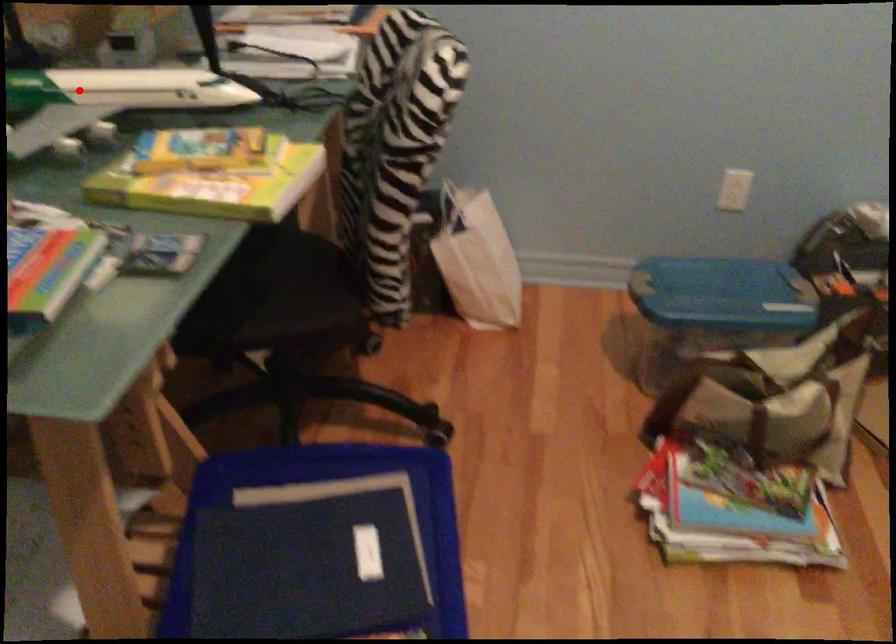
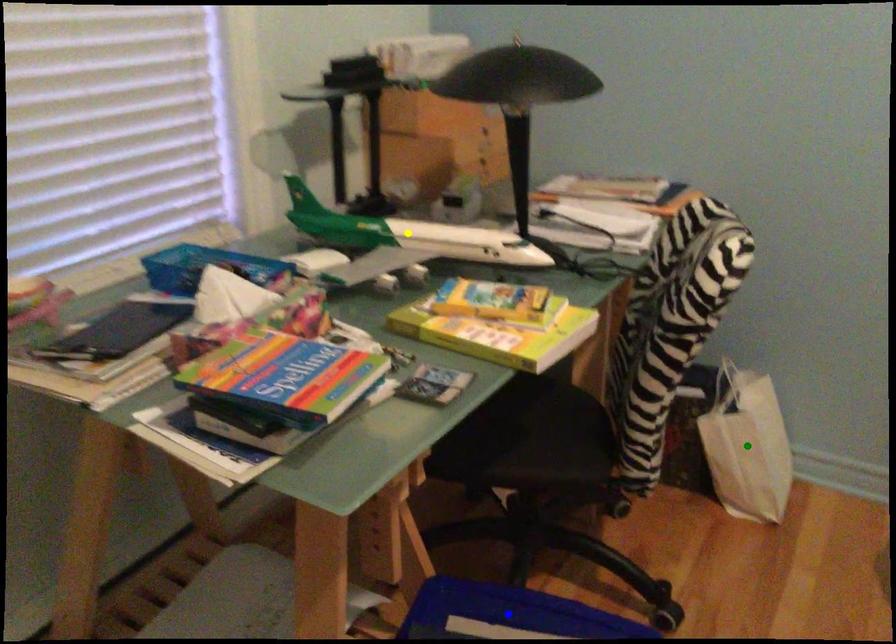
Question: I am providing you with two images of the same scene from different viewpoints. A red point is marked on the first image. You are given multiple points on the second image. Which mark in image 2 goes with the point in image 1?

Choices:
 (A) green point
 (B) blue point
 (C) yellow point

Answer: (C)